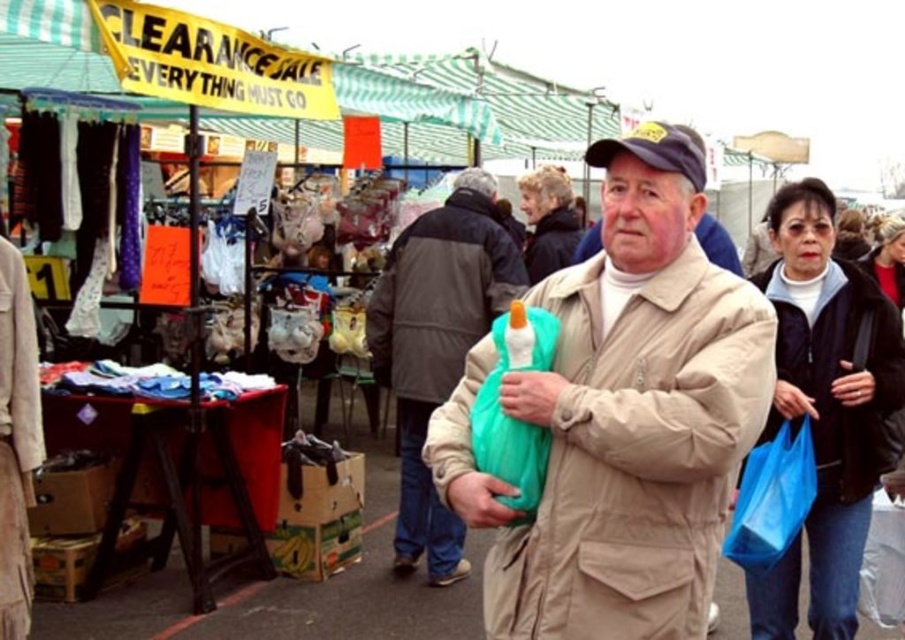
Question: Which of the following is the closest to the observer?

Choices:
 (A) matte plastic bag at center
 (B) tan matte trench coat at center

Answer: (B)

Question: Which point is farther to the camera?

Choices:
 (A) (713, 364)
 (B) (411, 253)

Answer: (B)

Question: Is tan matte trench coat at center wider than matte plastic bag at center?

Choices:
 (A) yes
 (B) no

Answer: (A)

Question: Observing the image, what is the correct spatial positioning of tan matte trench coat at center in reference to matte plastic bag at center?

Choices:
 (A) above
 (B) below

Answer: (A)

Question: Does tan matte trench coat at center come in front of matte plastic bag at center?

Choices:
 (A) no
 (B) yes

Answer: (B)